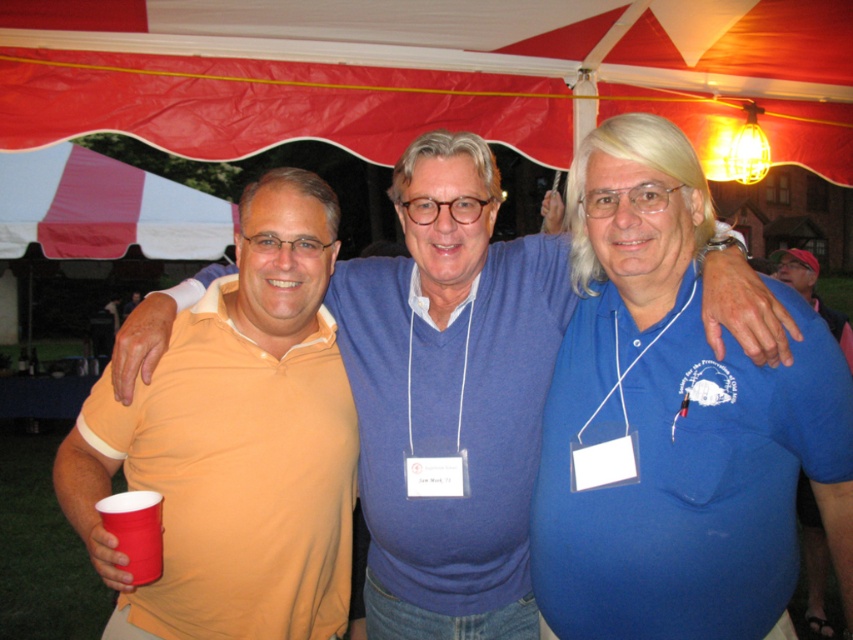
Who is taller, orange matte polo shirt at center or red plastic cup at lower left?

orange matte polo shirt at center is taller.

Between point (310, 328) and point (141, 582), which one is positioned in front?

Point (141, 582)

The image size is (853, 640). Find the location of `orange matte polo shirt at center`. orange matte polo shirt at center is located at coordinates (236, 442).

Between point (657, 252) and point (141, 515), which one is positioned behind?

Positioned behind is point (657, 252).

Between blue cotton shirt at center and red plastic cup at lower left, which one appears on the left side from the viewer's perspective?

From the viewer's perspective, red plastic cup at lower left appears more on the left side.

Locate an element on the screen. The height and width of the screenshot is (640, 853). blue cotton shirt at center is located at coordinates (674, 420).

Who is positioned more to the left, blue cotton shirt at center or orange matte polo shirt at center?

orange matte polo shirt at center

Is point (749, 499) positioned in front of point (70, 484)?

That is True.

Is point (688, 477) closer to camera compared to point (252, 234)?

That is True.

Where is `blue cotton shirt at center`? The height and width of the screenshot is (640, 853). blue cotton shirt at center is located at coordinates (674, 420).